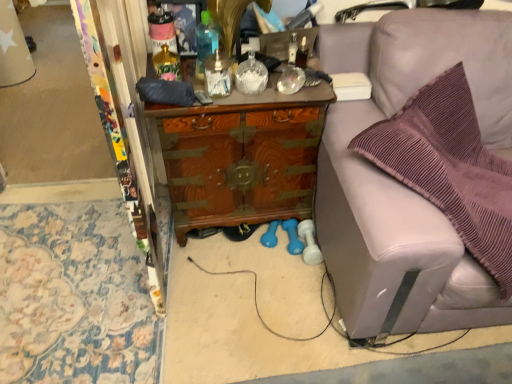
Where is `vacant area that lies in front of wooden chest at center`? The image size is (512, 384). vacant area that lies in front of wooden chest at center is located at coordinates (244, 292).